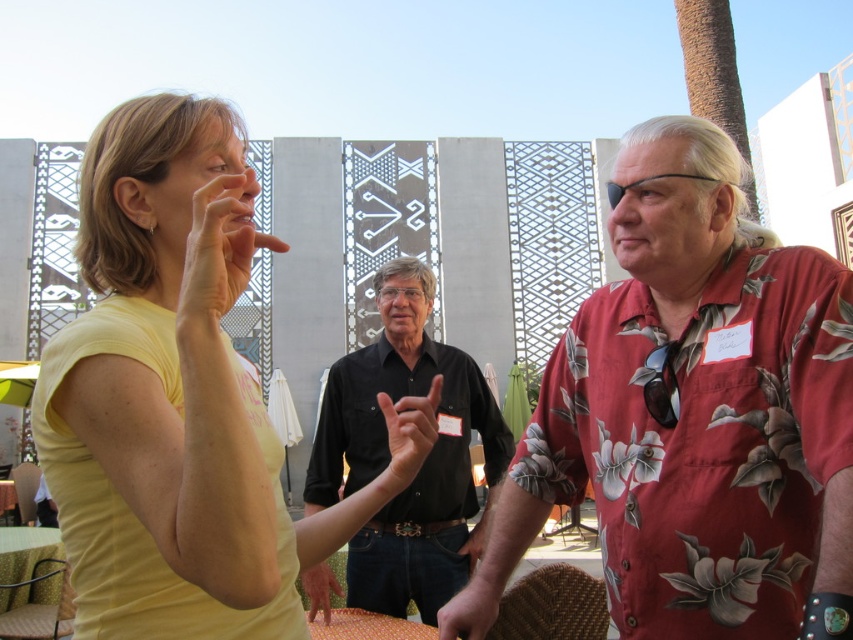
Question: Can you confirm if yellow matte shirt at upper left is positioned to the right of smooth skin hand at center?

Choices:
 (A) no
 (B) yes

Answer: (A)

Question: Considering the real-world distances, which object is closest to the black cotton shirt at center?

Choices:
 (A) floral print shirt at right
 (B) matte yellow hand at upper center

Answer: (A)

Question: Among these points, which one is nearest to the camera?

Choices:
 (A) (489, 618)
 (B) (670, 320)
 (C) (283, 547)
 (D) (323, 593)

Answer: (C)

Question: Can you confirm if floral print shirt at right is bigger than black cotton shirt at center?

Choices:
 (A) no
 (B) yes

Answer: (B)

Question: Does floral print shirt at right come in front of yellow matte shirt at upper left?

Choices:
 (A) no
 (B) yes

Answer: (A)

Question: Which object is closer to the camera taking this photo?

Choices:
 (A) black cotton shirt at center
 (B) floral print shirt at right
 (C) smooth skin hand at center

Answer: (B)